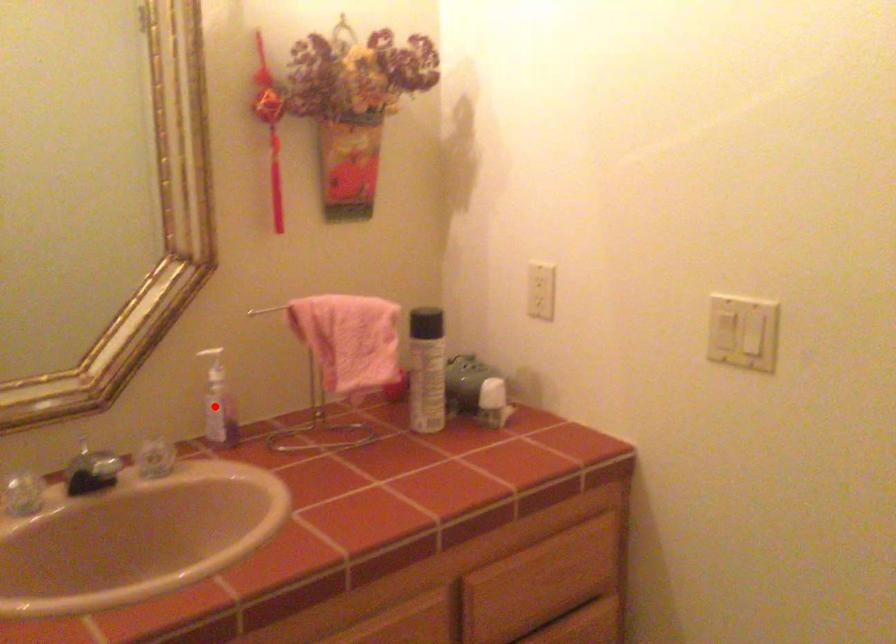
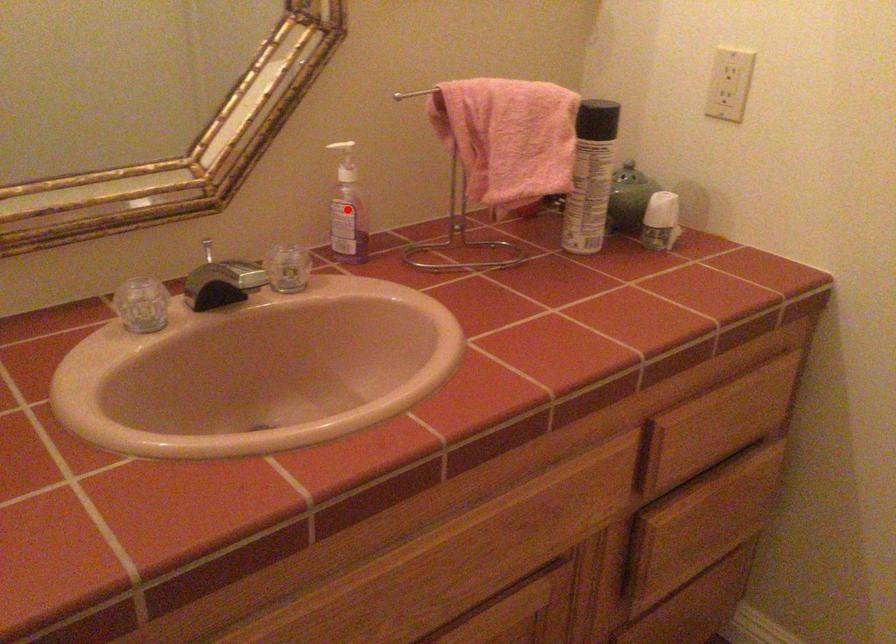
I am providing you with two images of the same scene from different viewpoints. A red point is marked on the first image and another point is marked on the second image. Do the highlighted points in image1 and image2 indicate the same real-world spot?

Yes